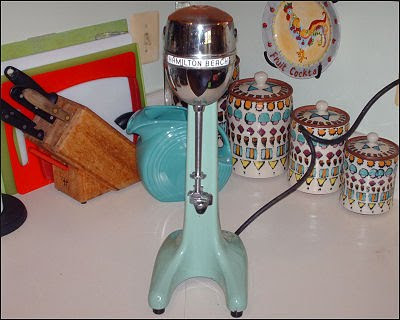
At what (x,y) coordinates should I click in order to perform the action: click on multi colored smallest jar of set. Please return your answer as a coordinate pair (x, y). Looking at the image, I should click on (359, 180).